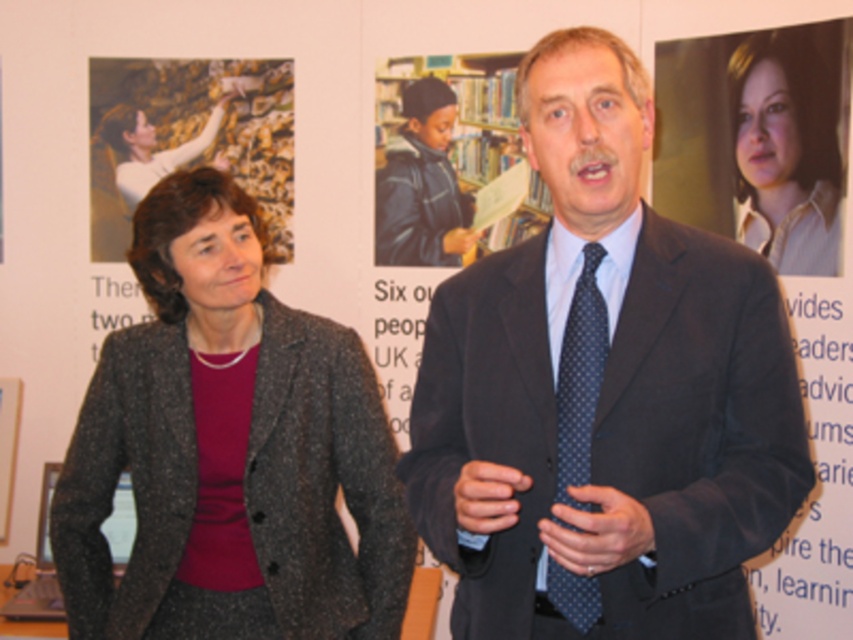
Based on the scene description, which object is taller between the dark gray textured blazer at left and the light brown shirt at upper right?

The dark gray textured blazer at left is taller than the light brown shirt at upper right according to the description.

You are standing in the room where the two people are talking. You want to place a small sticker exactly halfway between the point at (532, 212) and the point at (587, 376). Will the sticker be closer to the front or the back of the two points?

The sticker will be closer to the back because the point at (532, 212) is further to the camera than the point at (587, 376). Since the sticker is halfway between them, it will be closer to the point that is closer to the camera, which is the point at (587, 376). However, since the question asks whether it is closer to the front or back of the two points, the sticker is closer to the back point because it is further away from the camera. Wait, this seems conflicting. Let me clarify. If point A is at 0

You are an interior designer assessing the visual balance of the room. Considering the dark gray textured blazer at left and the dark blue dotted tie at center, which object appears taller in the scene?

The dark gray textured blazer at left appears taller than the dark blue dotted tie at center in the scene.